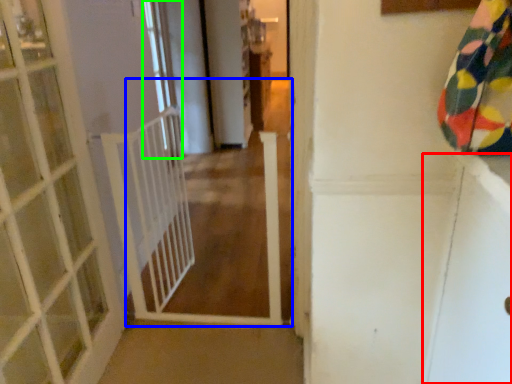
Question: Considering the real-world distances, which object is closest to screen door (highlighted by a red box)? path (highlighted by a blue box) or window (highlighted by a green box).

Choices:
 (A) path
 (B) window

Answer: (A)